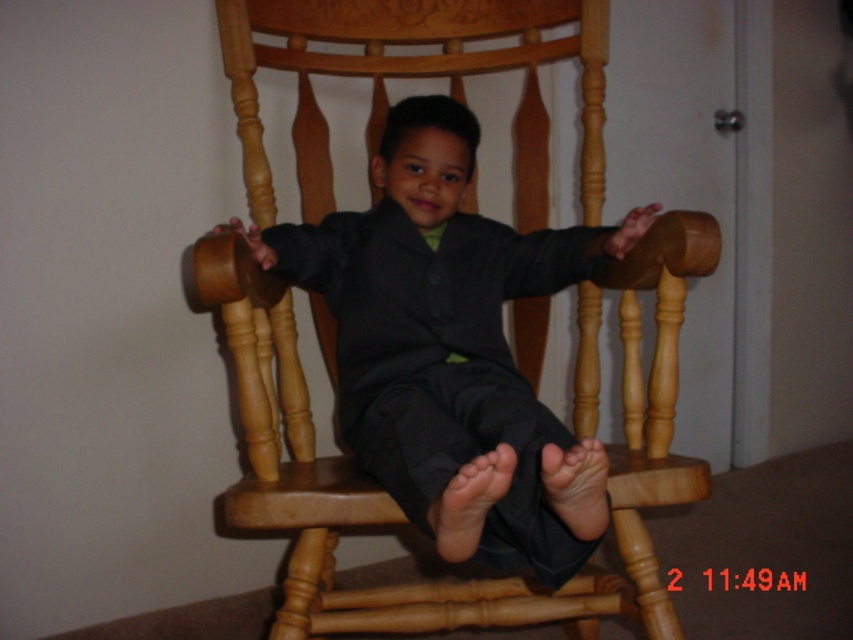
Between barefoot at center and smooth skin foot at center, which one is positioned lower?

Positioned lower is smooth skin foot at center.

Does barefoot at center have a larger size compared to smooth skin foot at center?

Yes.

Is point (440, 556) closer to camera compared to point (578, 518)?

No, (440, 556) is behind (578, 518).

The width and height of the screenshot is (853, 640). What are the coordinates of `barefoot at center` in the screenshot? It's located at (469, 502).

How distant is matte black suit at center from barefoot at center?

A distance of 9.55 inches exists between matte black suit at center and barefoot at center.

Does matte black suit at center have a greater height compared to barefoot at center?

Correct, matte black suit at center is much taller as barefoot at center.

Locate an element on the screen. Image resolution: width=853 pixels, height=640 pixels. matte black suit at center is located at coordinates (442, 330).

Is point (236, 220) closer to viewer compared to point (549, 502)?

That is False.

The height and width of the screenshot is (640, 853). I want to click on matte black suit at center, so click(442, 330).